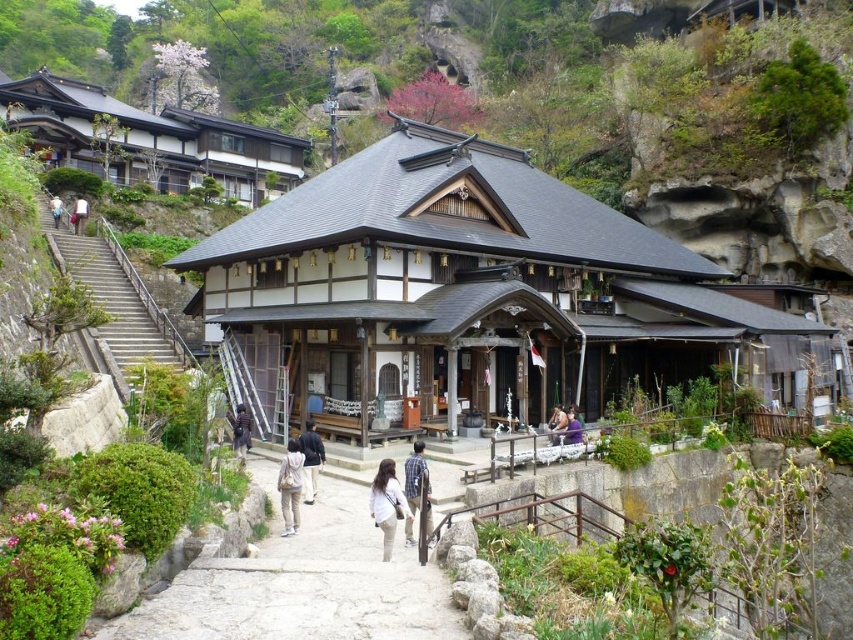
Question: Which of the following is the closest to the observer?

Choices:
 (A) (289, 484)
 (B) (241, 428)
 (C) (318, 291)

Answer: (A)

Question: Is beige fabric backpack at center to the left of white fabric bag at upper left from the viewer's perspective?

Choices:
 (A) no
 (B) yes

Answer: (A)

Question: Which of these objects is positioned farthest from the light brown fabric pants at center?

Choices:
 (A) light brown wooden chair at center
 (B) white cotton shirt at upper left

Answer: (B)

Question: Does plaid shirt at center come in front of white fabric bag at upper left?

Choices:
 (A) no
 (B) yes

Answer: (B)

Question: Which point is farther to the camera?

Choices:
 (A) (120, 371)
 (B) (59, 202)
 (C) (77, 218)
 (D) (247, 416)

Answer: (C)

Question: Considering the relative positions of gray concrete stairs at left and beige fabric backpack at center in the image provided, where is gray concrete stairs at left located with respect to beige fabric backpack at center?

Choices:
 (A) right
 (B) left

Answer: (B)